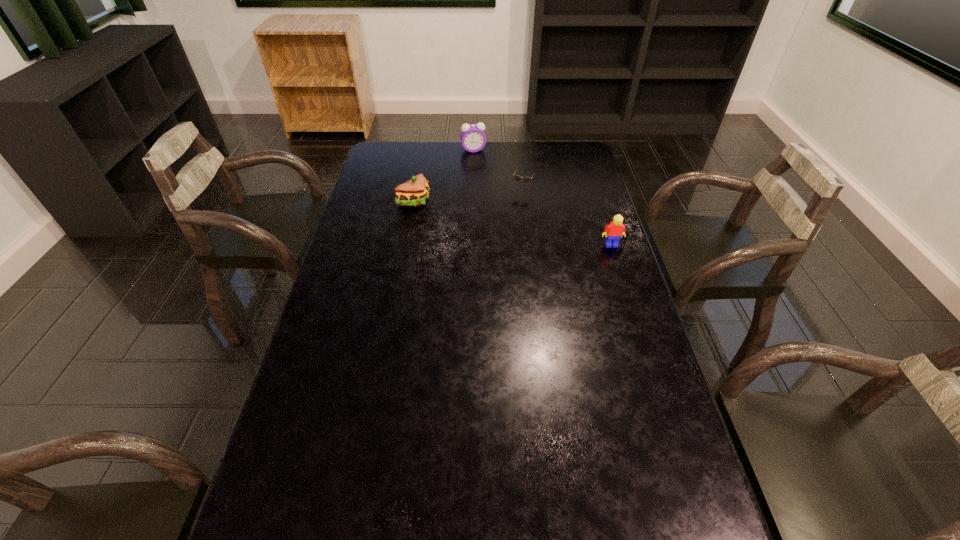
In the image, there is a desktop. What are the coordinates of `vacant space at the right edge` in the screenshot? It's located at (572, 184).

The image size is (960, 540). In order to click on free region at the far left corner of the desktop in this screenshot , I will do `click(376, 150)`.

Find the location of `empty space between the nearest object and the second object from right to left`. empty space between the nearest object and the second object from right to left is located at coordinates (565, 217).

Find the location of a particular element. The image size is (960, 540). blank region between the farthest object and the leftmost object is located at coordinates (444, 176).

Where is `vacant area that lies between the second object from right to left and the farthest object`? This screenshot has height=540, width=960. vacant area that lies between the second object from right to left and the farthest object is located at coordinates (497, 169).

Locate an element on the screen. vacant area that lies between the alarm clock and the second object from right to left is located at coordinates (497, 169).

In order to click on vacant area that lies between the alarm clock and the shortest object in this screenshot , I will do pos(497,169).

The image size is (960, 540). I want to click on empty space that is in between the leftmost object and the second object from left to right, so (444, 176).

At what (x,y) coordinates should I click in order to perform the action: click on free space between the farthest object and the leftmost object. Please return your answer as a coordinate pair (x, y). This screenshot has height=540, width=960. Looking at the image, I should click on (444, 176).

At what (x,y) coordinates should I click in order to perform the action: click on free spot between the sunglasses and the sandwich. Please return your answer as a coordinate pair (x, y). The height and width of the screenshot is (540, 960). Looking at the image, I should click on (468, 194).